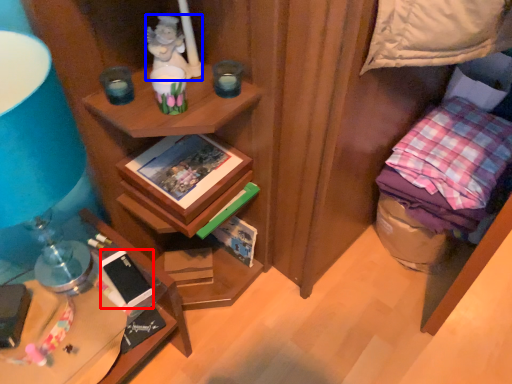
Question: Which object is further to the camera taking this photo, mobile phone (highlighted by a red box) or person (highlighted by a blue box)?

Choices:
 (A) mobile phone
 (B) person

Answer: (A)